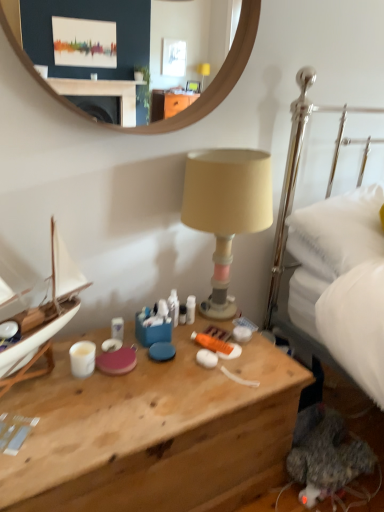
Locate an element on the screen. The width and height of the screenshot is (384, 512). white soft pillow at right is located at coordinates (338, 232).

Identify the location of wooden desk at center. This screenshot has width=384, height=512. (154, 432).

Image resolution: width=384 pixels, height=512 pixels. Describe the element at coordinates (154, 432) in the screenshot. I see `wooden desk at center` at that location.

The width and height of the screenshot is (384, 512). Identify the location of wooden mirror at upper center. (126, 33).

What is the approximate height of beige fabric lampshade at center?

It is 23.62 inches.

Locate an element on the screen. white soft pillow at right is located at coordinates (338, 232).

Which of these two, wooden desk at center or white plastic tube at center, stands shorter?

With less height is white plastic tube at center.

Measure the distance between wooden desk at center and white plastic tube at center.

The distance of wooden desk at center from white plastic tube at center is 18.01 inches.

From a real-world perspective, does wooden desk at center stand above white plastic tube at center?

No.

Between wooden desk at center and white plastic tube at center, which one is positioned behind?

white plastic tube at center.

Could white glossy coffee cup at lower left be considered to be inside wooden mirror at upper center?

Actually, white glossy coffee cup at lower left is outside wooden mirror at upper center.

Does point (147, 1) come in front of point (76, 375)?

No.

Is wooden mirror at upper center far from white glossy coffee cup at lower left?

No, wooden mirror at upper center is not far away from white glossy coffee cup at lower left.

From a real-world perspective, who is located higher, wooden mirror at upper center or white glossy coffee cup at lower left?

In real-world perspective, wooden mirror at upper center is above.

Can you confirm if white plastic tube at center is thinner than white soft pillow at right?

Yes.

Is white plastic tube at center completely or partially outside of white soft pillow at right?

Absolutely, white plastic tube at center is external to white soft pillow at right.

From the image's perspective, is white plastic tube at center on top of white soft pillow at right?

No, from the image's perspective, white plastic tube at center is not above white soft pillow at right.

Is point (192, 307) closer or farther from the camera than point (349, 242)?

Clearly, point (192, 307) is more distant from the camera than point (349, 242).

Is the surface of white plastic tube at center in direct contact with white glossy coffee cup at lower left?

They are not placed beside each other.

Does point (195, 302) come farther from viewer compared to point (85, 365)?

Yes, point (195, 302) is farther from viewer.

Who is smaller, white plastic tube at center or white glossy coffee cup at lower left?

Smaller between the two is white plastic tube at center.

From their relative heights in the image, would you say white plastic tube at center is taller or shorter than white glossy coffee cup at lower left?

Considering their sizes, white plastic tube at center has more height than white glossy coffee cup at lower left.

Can you confirm if wooden mirror at upper center is positioned to the left of white plastic tube at center?

Yes.

Would you say wooden mirror at upper center is a long distance from white plastic tube at center?

No, wooden mirror at upper center is not far away from white plastic tube at center.

At what (x,y) coordinates should I click in order to perform the action: click on mirror located above the white plastic tube at center (from the image's perspective). Please return your answer as a coordinate pair (x, y). Looking at the image, I should click on (126, 33).

Can you confirm if wooden mirror at upper center is taller than white plastic tube at center?

Yes, wooden mirror at upper center is taller than white plastic tube at center.

Which is more to the right, wooden desk at center or white soft pillow at right?

white soft pillow at right is more to the right.

Is point (201, 477) positioned before point (329, 198)?

Yes, point (201, 477) is in front of point (329, 198).

From the image's perspective, which is above, wooden desk at center or white soft pillow at right?

white soft pillow at right is shown above in the image.

How much distance is there between beige fabric lampshade at center and wooden desk at center?

beige fabric lampshade at center and wooden desk at center are 18.41 inches apart from each other.

Is beige fabric lampshade at center aimed at wooden desk at center?

No, beige fabric lampshade at center is not turned towards wooden desk at center.

Between point (268, 195) and point (251, 451), which one is positioned in front?

The point (251, 451) is in front.

What are the coordinates of `lamp on the right of wooden desk at center` in the screenshot? It's located at (226, 209).

Locate an element on the screen. This screenshot has height=512, width=384. desk below the white plastic tube at center (from the image's perspective) is located at coordinates pyautogui.click(x=154, y=432).

Where is `mirror that appears above the white glossy coffee cup at lower left (from a real-world perspective)`? The width and height of the screenshot is (384, 512). mirror that appears above the white glossy coffee cup at lower left (from a real-world perspective) is located at coordinates (126, 33).

Considering their positions, is beige fabric lampshade at center positioned closer to wooden desk at center than white plastic tube at center?

Among the two, white plastic tube at center is located nearer to wooden desk at center.

From the image, which object appears to be nearer to beige fabric lampshade at center, white soft pillow at right or wooden mirror at upper center?

white soft pillow at right lies closer to beige fabric lampshade at center than the other object.

From the image, which object appears to be farther from white glossy coffee cup at lower left, white soft pillow at right or wooden desk at center?

white soft pillow at right lies further to white glossy coffee cup at lower left than the other object.

Looking at the image, which one is located further to white soft pillow at right, wooden mirror at upper center or white plastic tube at center?

Based on the image, wooden mirror at upper center appears to be further to white soft pillow at right.

Considering their positions, is wooden desk at center positioned further to white glossy coffee cup at lower left than white plastic tube at center?

white plastic tube at center lies further to white glossy coffee cup at lower left than the other object.

Considering their positions, is beige fabric lampshade at center positioned closer to wooden desk at center than white soft pillow at right?

beige fabric lampshade at center is closer to wooden desk at center.

In the scene shown: Based on their spatial positions, is beige fabric lampshade at center or white soft pillow at right closer to white plastic tube at center?

beige fabric lampshade at center is closer to white plastic tube at center.

Which object lies further to the anchor point white plastic tube at center, white soft pillow at right or beige fabric lampshade at center?

white soft pillow at right lies further to white plastic tube at center than the other object.

The image size is (384, 512). I want to click on lamp between wooden mirror at upper center and white plastic tube at center in the up-down direction, so tap(226, 209).

Locate an element on the screen. lamp between wooden mirror at upper center and wooden desk at center from top to bottom is located at coordinates (226, 209).

You are a GUI agent. You are given a task and a screenshot of the screen. Output one action in this format:
    pyautogui.click(x=<x>, y=<y>)
    Task: Click on the toiletry between wooden mirror at upper center and white glossy coffee cup at lower left vertically
    
    Given the screenshot: What is the action you would take?
    tap(190, 309)

Find the location of a particular element. The width and height of the screenshot is (384, 512). mirror located between white glossy coffee cup at lower left and white soft pillow at right in the left-right direction is located at coordinates (126, 33).